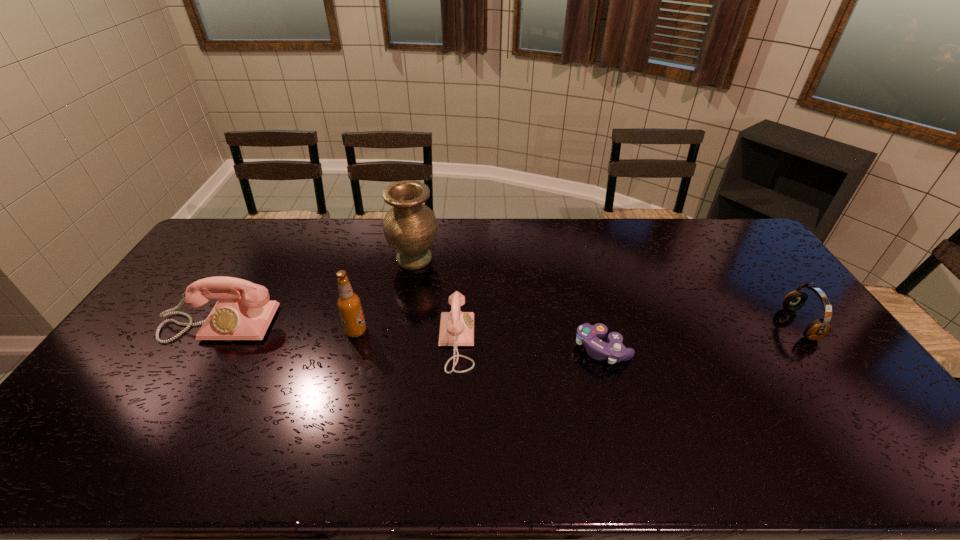
Locate an element on the screen. Image resolution: width=960 pixels, height=540 pixels. the left telephone is located at coordinates (234, 317).

This screenshot has height=540, width=960. I want to click on the taller telephone, so pyautogui.click(x=234, y=317).

At what (x,y) coordinates should I click in order to perform the action: click on the fourth object from left to right. Please return your answer as a coordinate pair (x, y). Looking at the image, I should click on (456, 327).

Identify the location of the shorter telephone. This screenshot has width=960, height=540. (456, 327).

In order to click on the farthest object in this screenshot , I will do `click(410, 227)`.

Where is `the fourth object from right to left`? This screenshot has width=960, height=540. the fourth object from right to left is located at coordinates (410, 227).

You are a GUI agent. You are given a task and a screenshot of the screen. Output one action in this format:
    pyautogui.click(x=<x>, y=<y>)
    Task: Click on the second object from left to right
    
    Given the screenshot: What is the action you would take?
    pyautogui.click(x=349, y=305)

This screenshot has width=960, height=540. I want to click on beer bottle, so click(x=349, y=305).

The height and width of the screenshot is (540, 960). In order to click on headset in this screenshot , I will do `click(817, 329)`.

You are a GUI agent. You are given a task and a screenshot of the screen. Output one action in this format:
    pyautogui.click(x=<x>, y=<y>)
    Task: Click on the shortest object
    The height and width of the screenshot is (540, 960).
    Given the screenshot: What is the action you would take?
    pyautogui.click(x=588, y=335)